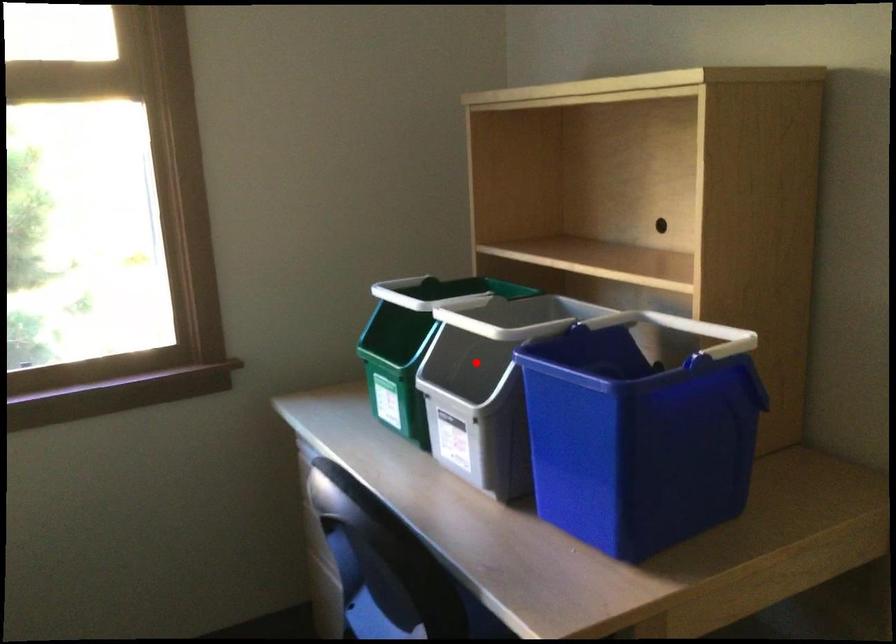
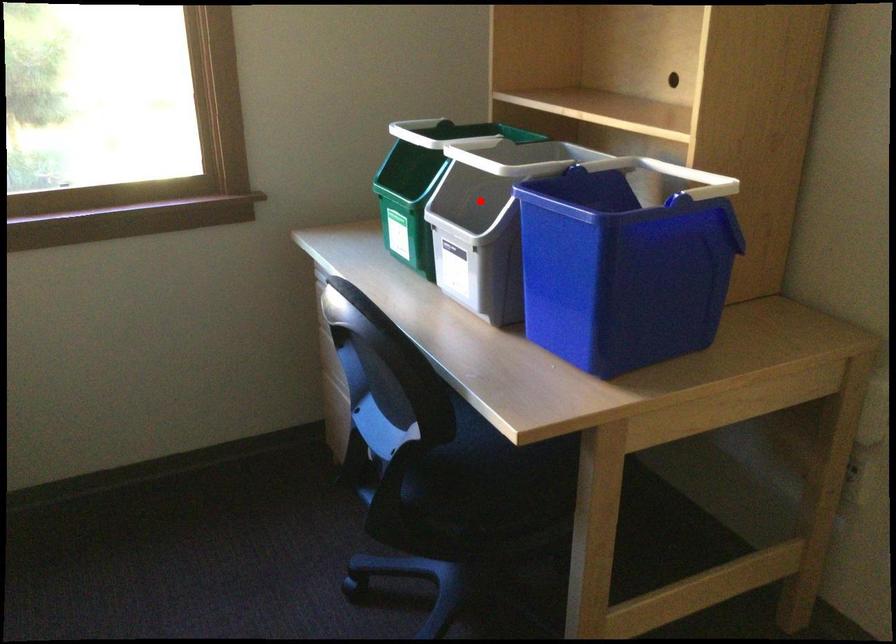
I am providing you with two images of the same scene from different viewpoints. A red point is marked on the first image and another point is marked on the second image. Does the point marked in image1 correspond to the same location as the one in image2?

Yes